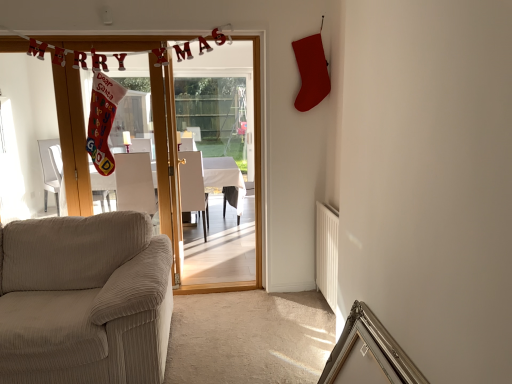
Question: From a real-world perspective, is wooden door at center on top of white glossy table at center?

Choices:
 (A) yes
 (B) no

Answer: (A)

Question: Can you confirm if wooden door at center is smaller than white glossy table at center?

Choices:
 (A) no
 (B) yes

Answer: (B)

Question: From the image's perspective, is wooden door at center on white glossy table at center?

Choices:
 (A) yes
 (B) no

Answer: (A)

Question: Does wooden door at center come in front of white glossy table at center?

Choices:
 (A) no
 (B) yes

Answer: (B)

Question: Does wooden door at center turn towards white glossy table at center?

Choices:
 (A) yes
 (B) no

Answer: (B)

Question: Is wooden door at center shorter than white glossy table at center?

Choices:
 (A) yes
 (B) no

Answer: (B)

Question: Can you confirm if white corduroy armchair at center, which is counted as the 1th armchair, starting from the left, is positioned to the right of white fabric armchair at center, positioned as the 1th armchair in right-to-left order?

Choices:
 (A) no
 (B) yes

Answer: (A)

Question: From the image's perspective, is white corduroy armchair at center, which is counted as the 1th armchair, starting from the left, under white fabric armchair at center, which is the second armchair in left-to-right order?

Choices:
 (A) yes
 (B) no

Answer: (B)

Question: From a real-world perspective, is white corduroy armchair at center, acting as the 2th armchair starting from the right, physically below white fabric armchair at center, which is the second armchair in left-to-right order?

Choices:
 (A) yes
 (B) no

Answer: (B)

Question: Is white fabric armchair at center, positioned as the 1th armchair in right-to-left order, completely or partially inside white corduroy armchair at center, which is counted as the 1th armchair, starting from the left?

Choices:
 (A) yes
 (B) no

Answer: (B)

Question: Can you confirm if white corduroy armchair at center, acting as the 2th armchair starting from the right, is taller than white fabric armchair at center, which is the second armchair in left-to-right order?

Choices:
 (A) yes
 (B) no

Answer: (B)

Question: Is white corduroy armchair at center, which is counted as the 1th armchair, starting from the left, next to white fabric armchair at center, positioned as the 1th armchair in right-to-left order?

Choices:
 (A) no
 (B) yes

Answer: (A)

Question: Is wooden door at center smaller than beige corduroy couch at lower left?

Choices:
 (A) yes
 (B) no

Answer: (A)